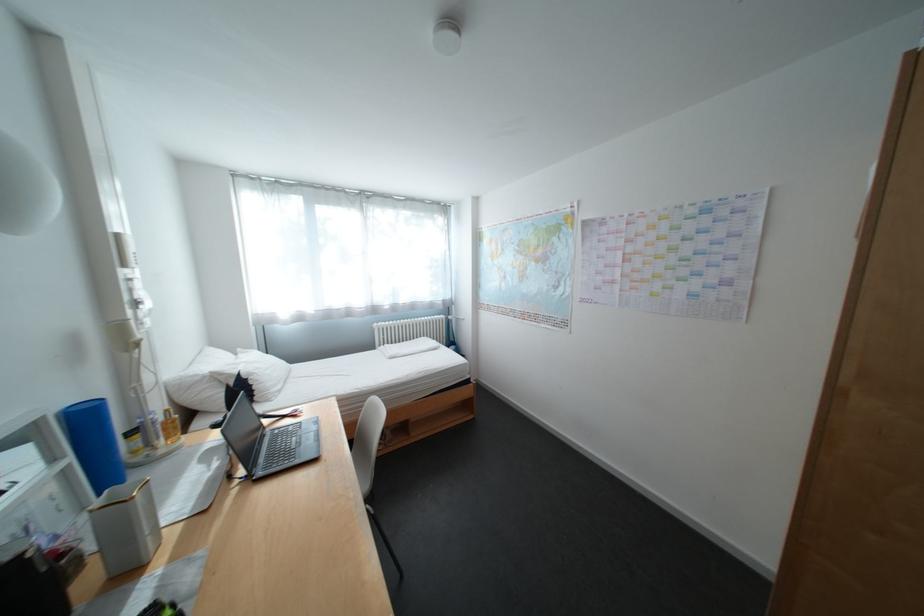
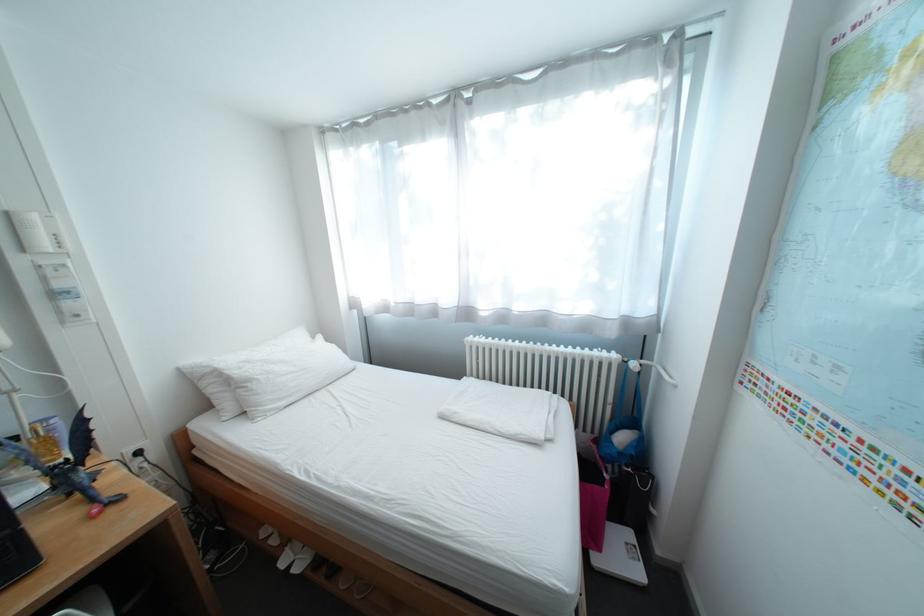
Locate, in the second image, the point that corresponds to (x=264, y=376) in the first image.

(263, 383)